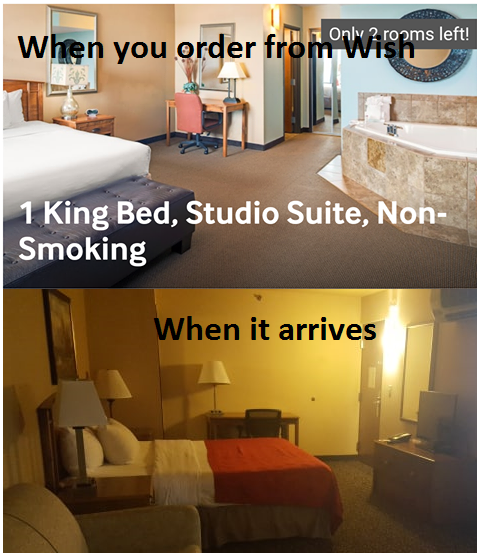
This screenshot has width=477, height=553. In order to click on painting in this screenshot , I will do `click(63, 352)`.